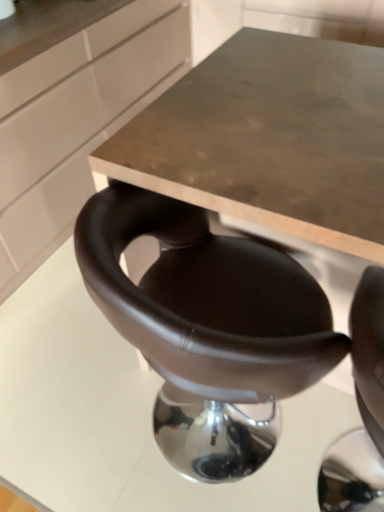
Question: Considering the relative positions of matte white cabinet at upper left and brown leather chair at center in the image provided, is matte white cabinet at upper left to the right of brown leather chair at center from the viewer's perspective?

Choices:
 (A) no
 (B) yes

Answer: (A)

Question: From the image's perspective, does matte white cabinet at upper left appear higher than brown leather chair at center?

Choices:
 (A) yes
 (B) no

Answer: (A)

Question: Is matte white cabinet at upper left smaller than brown leather chair at center?

Choices:
 (A) no
 (B) yes

Answer: (A)

Question: Is matte white cabinet at upper left in contact with brown leather chair at center?

Choices:
 (A) yes
 (B) no

Answer: (B)

Question: Is matte white cabinet at upper left outside of brown leather chair at center?

Choices:
 (A) yes
 (B) no

Answer: (A)

Question: Is matte white cabinet at upper left closer to the viewer compared to brown leather chair at center?

Choices:
 (A) no
 (B) yes

Answer: (A)

Question: Is brown leather chair at center aimed at matte white cabinet at upper left?

Choices:
 (A) yes
 (B) no

Answer: (B)

Question: Does brown leather chair at center have a greater width compared to matte white cabinet at upper left?

Choices:
 (A) no
 (B) yes

Answer: (B)

Question: Is brown leather chair at center far from matte white cabinet at upper left?

Choices:
 (A) no
 (B) yes

Answer: (B)

Question: Is brown leather chair at center shorter than matte white cabinet at upper left?

Choices:
 (A) no
 (B) yes

Answer: (B)

Question: From the image's perspective, does brown leather chair at center appear lower than matte white cabinet at upper left?

Choices:
 (A) no
 (B) yes

Answer: (B)

Question: Is brown leather chair at center positioned with its back to matte white cabinet at upper left?

Choices:
 (A) no
 (B) yes

Answer: (A)

Question: Choose the correct answer: Is matte white cabinet at upper left inside brown leather chair at center or outside it?

Choices:
 (A) inside
 (B) outside

Answer: (B)